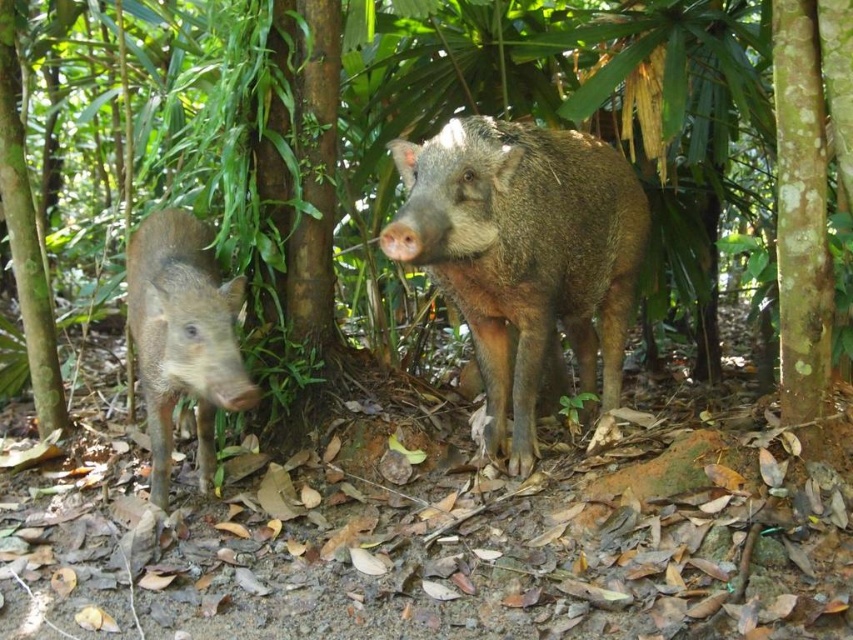
You are a wildlife photographer aiming to capture a clear photo of both the brown rough textured pig at center and the brown matte pig at left. Based on their positions, which pig should you focus on first to ensure it appears sharp in the foreground?

The brown rough textured pig at center should be focused on first because it is in front of the brown matte pig at left, making it closer to the camera and thus the foreground subject.

You are a wildlife photographer aiming to capture a closeup of the brown rough textured pig at center. Your camera is currently focused on the point at coordinates point (524, 253). Is the focus point on the correct animal?

The point (524, 253) is on the brown rough textured pig at center, so yes, the focus point is correctly placed on the brown rough textured pig at center.

You are a wildlife photographer aiming to capture a closeup shot of both the brown rough textured pig at center and the brown matte pig at left. Your camera has a maximum focus range of 3 feet. Can you take a photo of both pigs at the same time without moving your position?

The brown rough textured pig at center is 3.30 feet from the brown matte pig at left. Since the distance between them is 0.30 feet beyond the camera maximum focus range of 3 feet, you cannot capture both pigs in focus at the same time.